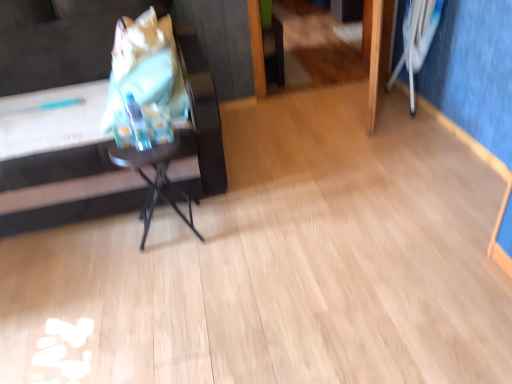
What are the coordinates of `free location in front of white fabric swivel chair at upper right` in the screenshot? It's located at (x=416, y=123).